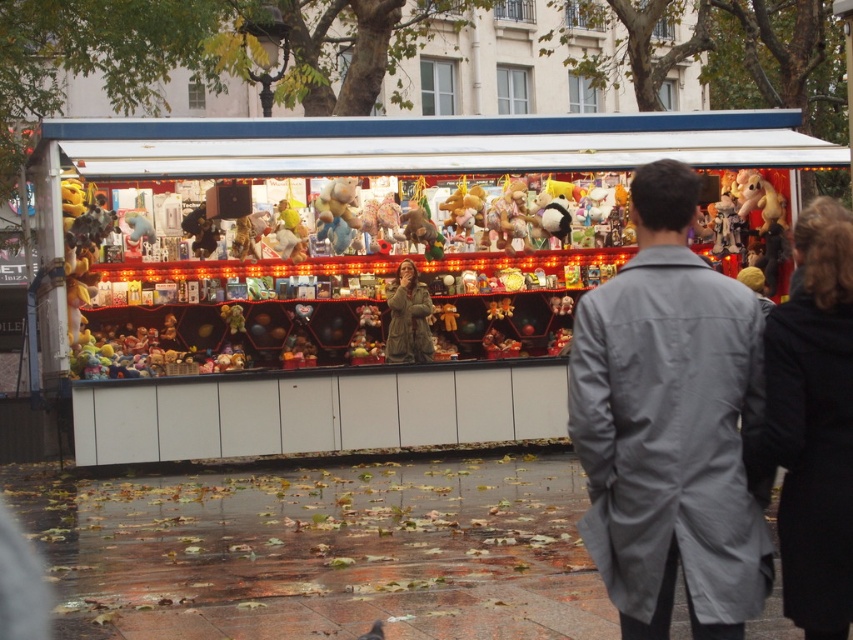
Question: Is matte plastic toy stand at center thinner than gray fabric coat at center?

Choices:
 (A) no
 (B) yes

Answer: (B)

Question: Is matte plastic toy stand at center further to the viewer compared to gray fabric coat at center?

Choices:
 (A) no
 (B) yes

Answer: (B)

Question: Which object appears farthest from the camera in this image?

Choices:
 (A) matte plastic toy stand at center
 (B) gray fabric coat at center

Answer: (A)

Question: Is matte plastic toy stand at center further to the viewer compared to gray fabric coat at center?

Choices:
 (A) no
 (B) yes

Answer: (B)